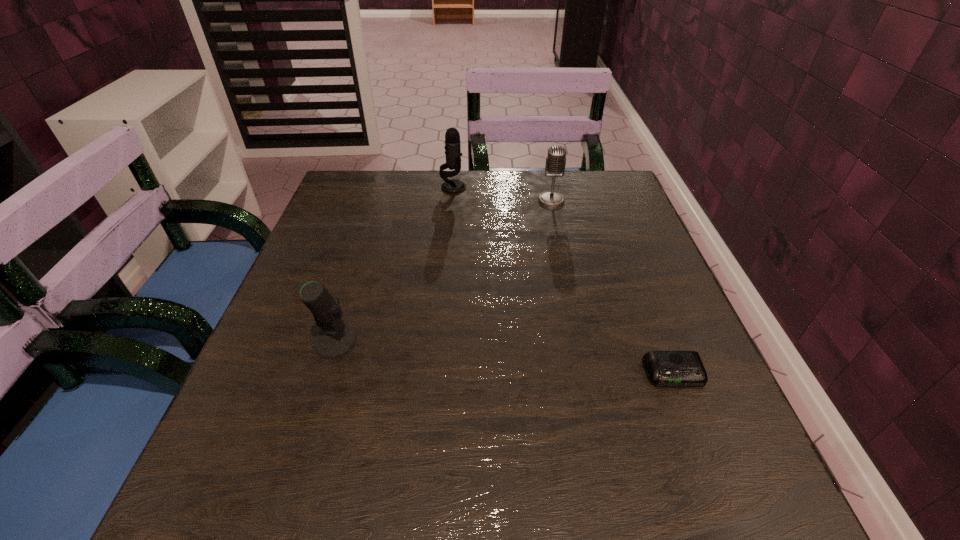
Locate which microphone ranks third in proximity to the shortest object. Please provide its 2D coordinates. Your answer should be formatted as a tuple, i.e. [(x, y)], where the tuple contains the x and y coordinates of a point satisfying the conditions above.

[(453, 153)]

Find the location of a particular element. This screenshot has width=960, height=540. vacant point that satisfies the following two spatial constraints: 1. on the back side of the rightmost microphone; 2. on the left side of the leftmost object is located at coordinates (379, 200).

The image size is (960, 540). Find the location of `vacant space that satisfies the following two spatial constraints: 1. on the front side of the second object from right to left; 2. on the right side of the third object from right to left`. vacant space that satisfies the following two spatial constraints: 1. on the front side of the second object from right to left; 2. on the right side of the third object from right to left is located at coordinates (452, 200).

Where is `vacant space that satisfies the following two spatial constraints: 1. on the back side of the second object from right to left; 2. on the right side of the nearest microphone`? The width and height of the screenshot is (960, 540). vacant space that satisfies the following two spatial constraints: 1. on the back side of the second object from right to left; 2. on the right side of the nearest microphone is located at coordinates (379, 200).